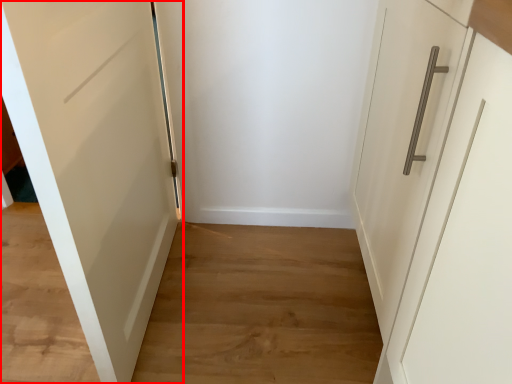
Question: Observing the image, what is the correct spatial positioning of door (annotated by the red box) in reference to path?

Choices:
 (A) left
 (B) right

Answer: (B)